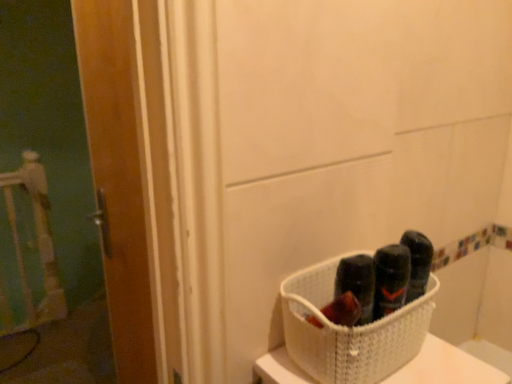
Image resolution: width=512 pixels, height=384 pixels. Identify the location of wooden door at left. (122, 182).

Describe the element at coordinates (122, 182) in the screenshot. I see `wooden door at left` at that location.

This screenshot has height=384, width=512. What do you see at coordinates (349, 330) in the screenshot?
I see `white woven basket at lower right` at bounding box center [349, 330].

What are the coordinates of `white woven basket at lower right` in the screenshot? It's located at (349, 330).

Locate an element on the screen. Image resolution: width=512 pixels, height=384 pixels. wooden door at left is located at coordinates (122, 182).

Can you confirm if wooden door at left is positioned to the left of white woven basket at lower right?

Indeed, wooden door at left is positioned on the left side of white woven basket at lower right.

Which is in front, wooden door at left or white woven basket at lower right?

Positioned in front is white woven basket at lower right.

Is point (86, 111) farther from viewer compared to point (382, 338)?

Yes.

From the image's perspective, is wooden door at left above or below white woven basket at lower right?

From the image's perspective, wooden door at left appears above white woven basket at lower right.

From a real-world perspective, is wooden door at left above or below white woven basket at lower right?

From a real-world perspective, wooden door at left is physically below white woven basket at lower right.

Considering the sizes of wooden door at left and white woven basket at lower right in the image, is wooden door at left wider or thinner than white woven basket at lower right?

Considering their sizes, wooden door at left looks slimmer than white woven basket at lower right.

Considering the relative sizes of wooden door at left and white woven basket at lower right in the image provided, is wooden door at left taller than white woven basket at lower right?

Indeed, wooden door at left has a greater height compared to white woven basket at lower right.

Looking at this image, is wooden door at left bigger or smaller than white woven basket at lower right?

Clearly, wooden door at left is larger in size than white woven basket at lower right.

Is wooden door at left positioned beyond the bounds of white woven basket at lower right?

Absolutely, wooden door at left is external to white woven basket at lower right.

Would you consider wooden door at left to be distant from white woven basket at lower right?

No.

Is wooden door at left oriented towards white woven basket at lower right?

No, wooden door at left is not aimed at white woven basket at lower right.

What's the angular difference between wooden door at left and white woven basket at lower right's facing directions?

wooden door at left and white woven basket at lower right are facing 89.3 degrees away from each other.

How distant is wooden door at left from white woven basket at lower right?

wooden door at left is 21.51 inches away from white woven basket at lower right.

Identify the location of basket in front of the wooden door at left. The height and width of the screenshot is (384, 512). (349, 330).

Is white woven basket at lower right to the left or to the right of wooden door at left in the image?

In the image, white woven basket at lower right appears on the right side of wooden door at left.

Between white woven basket at lower right and wooden door at left, which one is positioned in front?

white woven basket at lower right is closer to the camera.

Does point (402, 340) come behind point (100, 106)?

No, it is in front of (100, 106).

From the image's perspective, which is above, white woven basket at lower right or wooden door at left?

From the image's view, wooden door at left is above.

From the picture: From a real-world perspective, is white woven basket at lower right located beneath wooden door at left?

Incorrect, from a real-world perspective, white woven basket at lower right is higher than wooden door at left.

Which object is wider, white woven basket at lower right or wooden door at left?

With larger width is white woven basket at lower right.

Is white woven basket at lower right shorter than wooden door at left?

Yes.

Is white woven basket at lower right bigger or smaller than wooden door at left?

Considering their sizes, white woven basket at lower right takes up less space than wooden door at left.

Is white woven basket at lower right completely or partially outside of wooden door at left?

Indeed, white woven basket at lower right is completely outside wooden door at left.

Is white woven basket at lower right far away from wooden door at left?

No, white woven basket at lower right is in close proximity to wooden door at left.

Is white woven basket at lower right aimed at wooden door at left?

No, white woven basket at lower right is not turned towards wooden door at left.

How distant is white woven basket at lower right from wooden door at left?

white woven basket at lower right is 21.51 inches away from wooden door at left.

Image resolution: width=512 pixels, height=384 pixels. Find the location of `door that is under the white woven basket at lower right (from a real-world perspective)`. door that is under the white woven basket at lower right (from a real-world perspective) is located at coordinates (122, 182).

This screenshot has width=512, height=384. In the image, there is a white woven basket at lower right. Identify the location of door above it (from the image's perspective). (122, 182).

Find the location of `door behind the white woven basket at lower right`. door behind the white woven basket at lower right is located at coordinates (122, 182).